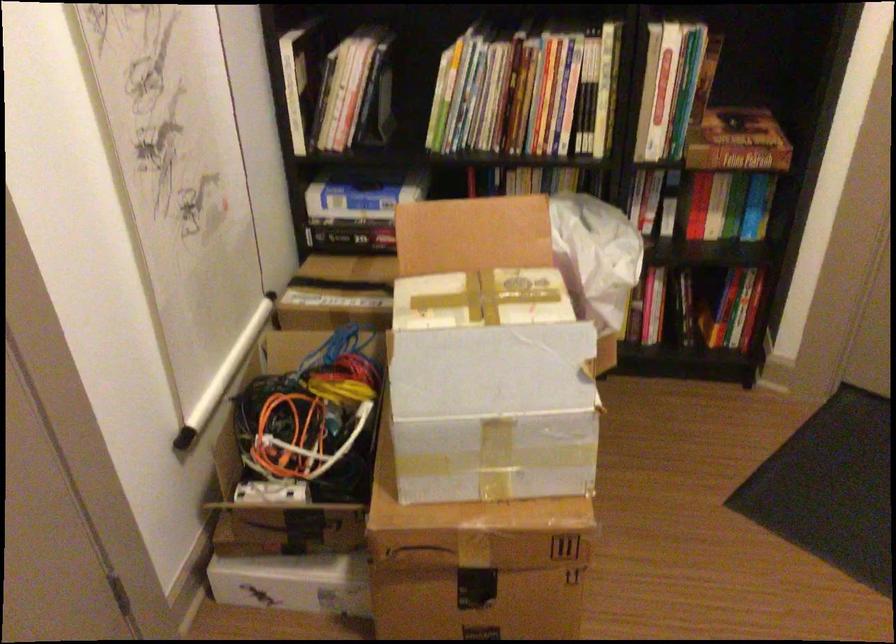
Locate an element on the screen. This screenshot has width=896, height=644. book box set is located at coordinates (703, 204).